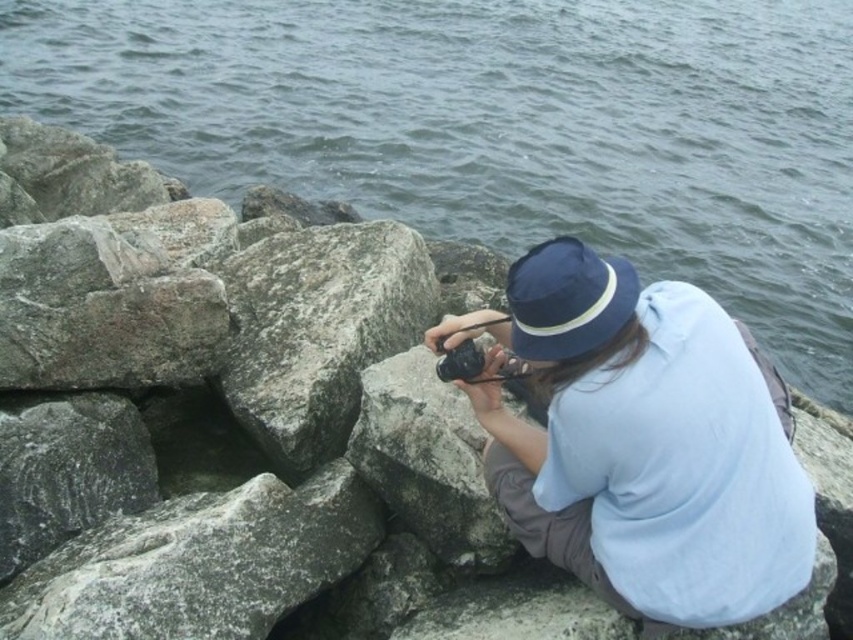
Is blue fabric hat at center to the left of gray rough stone at lower left from the viewer's perspective?

No, blue fabric hat at center is not to the left of gray rough stone at lower left.

Locate an element on the screen. This screenshot has width=853, height=640. blue fabric hat at center is located at coordinates (645, 444).

Does point (619, 515) come closer to viewer compared to point (102, 609)?

Yes, it is in front of point (102, 609).

Where is `blue fabric hat at center`? blue fabric hat at center is located at coordinates (645, 444).

Does gray water at upper center come behind blue fabric hat at upper center?

Yes, it is.

Does point (514, 58) lie in front of point (554, 320)?

No, (514, 58) is behind (554, 320).

This screenshot has width=853, height=640. In order to click on gray water at upper center in this screenshot , I will do 502,129.

Between point (440, 336) and point (279, 291), which one is positioned behind?

The point (279, 291) is more distant.

Which is below, blue fabric hat at center or gray rough rock at center?

blue fabric hat at center is below.

Is point (497, 456) more distant than point (231, 401)?

No, (497, 456) is closer to viewer.

The height and width of the screenshot is (640, 853). Find the location of `blue fabric hat at center`. blue fabric hat at center is located at coordinates (645, 444).